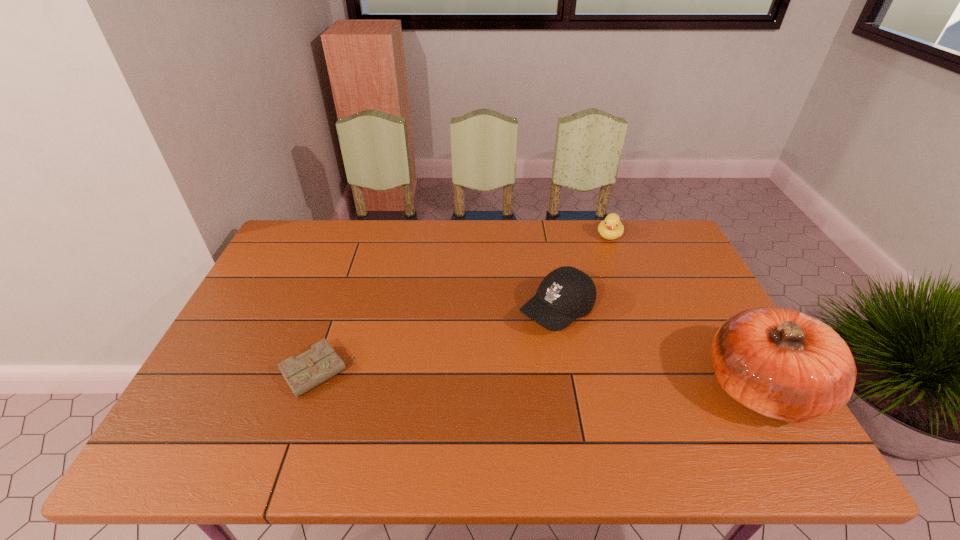
This screenshot has height=540, width=960. In order to click on free space on the desktop that is between the leftmost object and the pumpkin and is positioned on the front-facing side of the third object from right to left in this screenshot , I will do `click(475, 377)`.

At what (x,y) coordinates should I click in order to perform the action: click on vacant space on the desktop that is between the leftmost object and the pumpkin and is positioned on the beak of the farthest object. Please return your answer as a coordinate pair (x, y). The height and width of the screenshot is (540, 960). Looking at the image, I should click on (554, 380).